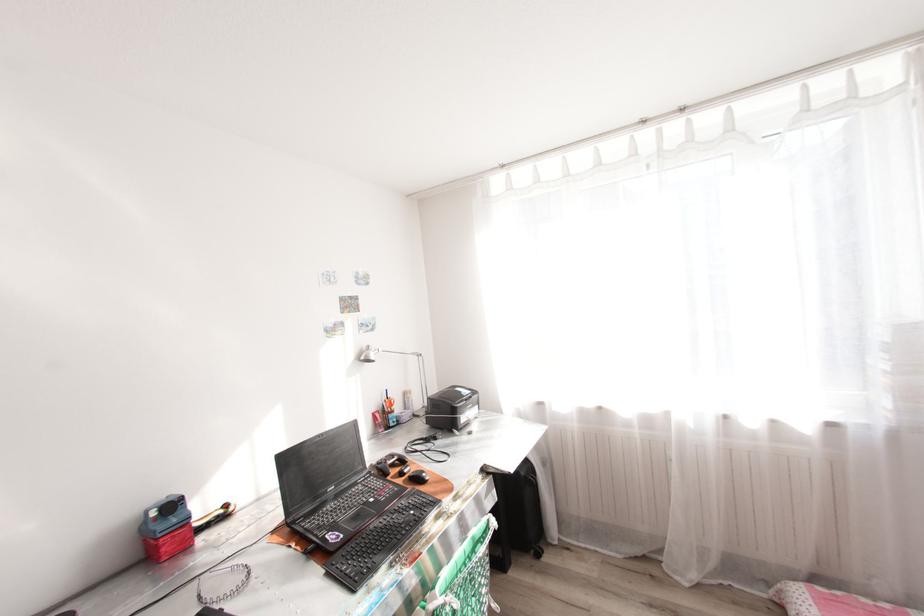
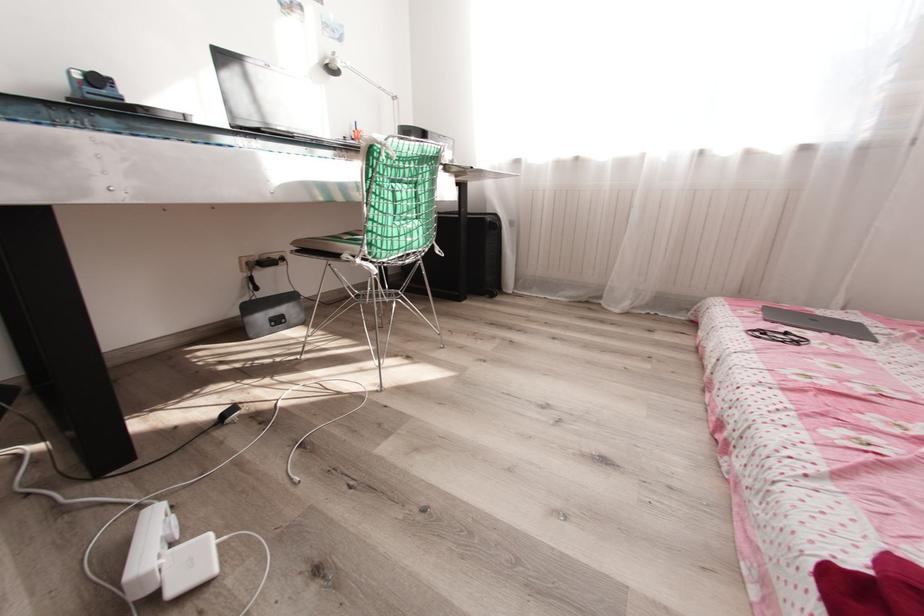
In a continuous first-person perspective shot, in which direction is the camera moving?

The movement direction of the cameraman is right, backward.